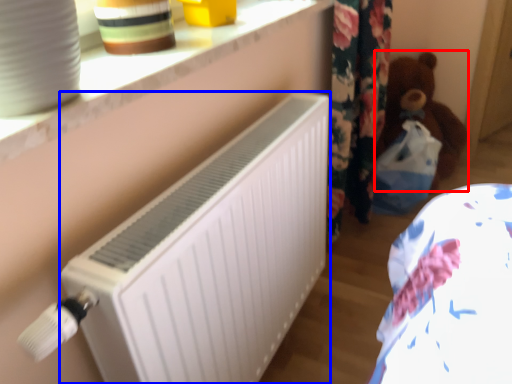
Question: Which object appears farthest to the camera in this image, teddy (highlighted by a red box) or radiator (highlighted by a blue box)?

Choices:
 (A) teddy
 (B) radiator

Answer: (A)